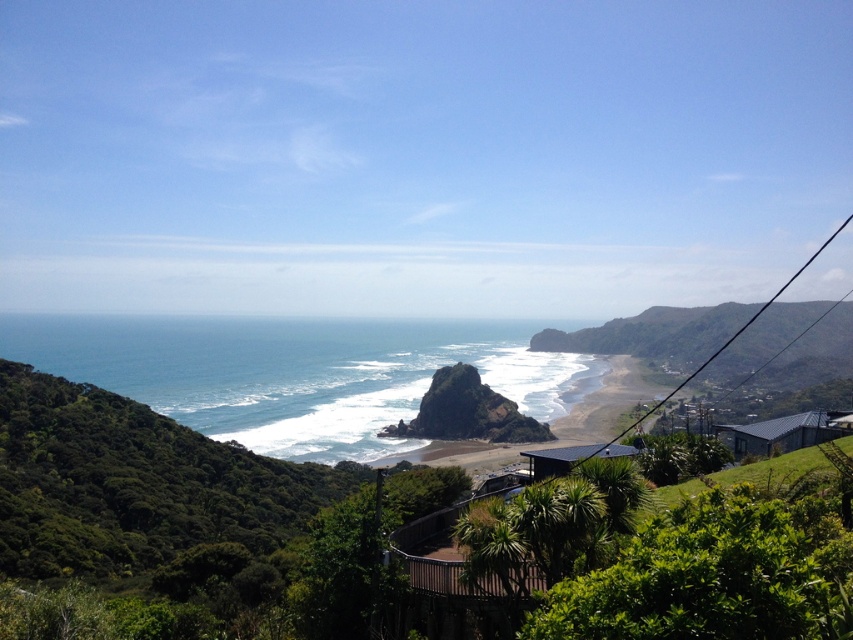
You are a delivery drone that needs to deliver a package to the gray corrugated metal hut at lower right. Your current position is above the blue ocean water at center. The maximum horizontal distance you can travel is 250 meters. Can you reach the destination without needing a recharge?

The blue ocean water at center and gray corrugated metal hut at lower right are 274.01 meters apart from each other. Since the maximum horizontal distance you can travel is 250 meters, you cannot reach the destination without needing a recharge.

Consider the image. You are standing on the beach in the coastal landscape image. You see two points marked on the image. Which point is closer to you, point (357, 353) or point (537, 464)?

Point (357, 353) is closer to you because it is further to the viewer than point (537, 464).